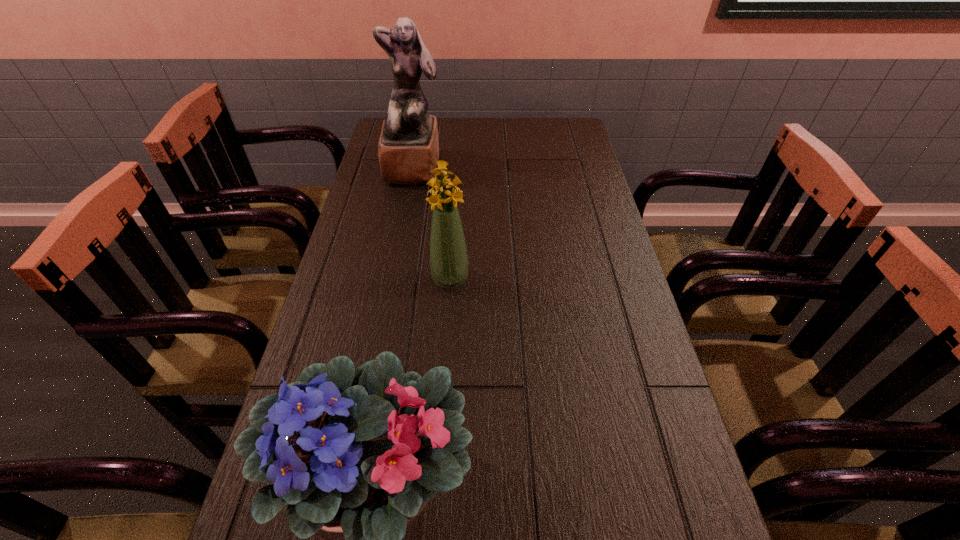
Where is `vacant area at the left edge of the desktop`? The height and width of the screenshot is (540, 960). vacant area at the left edge of the desktop is located at coordinates pyautogui.click(x=357, y=286).

Image resolution: width=960 pixels, height=540 pixels. What are the coordinates of `vacant space at the right edge of the desktop` in the screenshot? It's located at (586, 197).

Find the location of a particular element. The image size is (960, 540). object identified as the closest to the sculpture is located at coordinates (448, 255).

This screenshot has width=960, height=540. What are the coordinates of `object that is the second nearest to the second tallest object` in the screenshot? It's located at (408, 149).